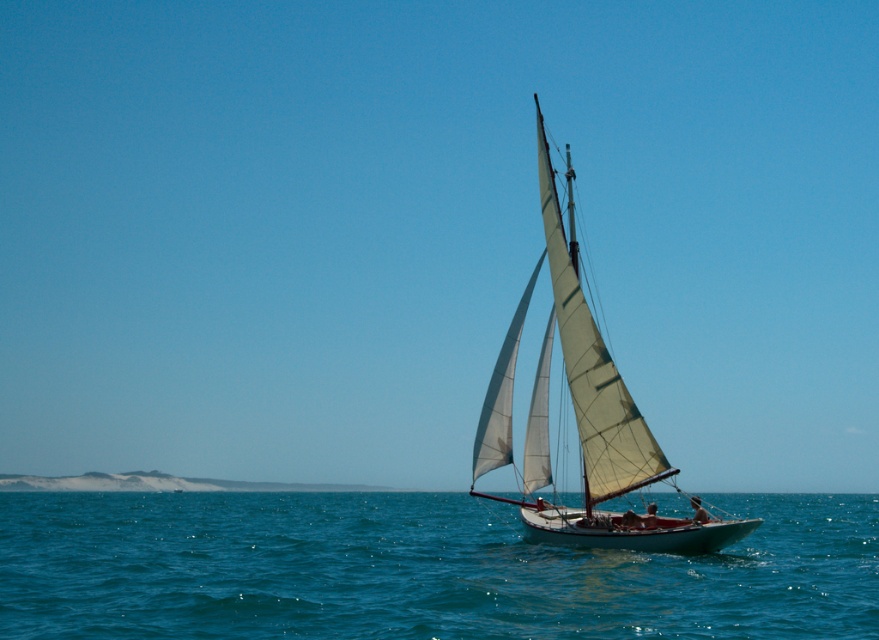
You are a photographer trying to capture the sailboat scene. You want to ensure that both the blue water at center and the white canvas sail at center are clearly visible in your photo. Given their sizes, which object should you focus on to ensure both are in frame?

The blue water at center is bigger than the white canvas sail at center, so focusing on the larger blue water at center will help ensure both objects are in frame while maintaining their visibility.

You are standing on the deck of the sailboat and want to point out the blue water at center and the white canvas sail at center to someone. Which one is located to the left?

The blue water at center is to the left of the white canvas sail at center.